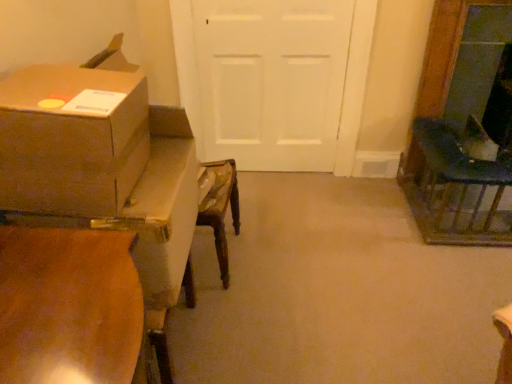
Question: Would you say wooden table at left is outside brown cardboard box at left?

Choices:
 (A) no
 (B) yes

Answer: (B)

Question: Can you confirm if wooden table at left is smaller than brown cardboard box at left?

Choices:
 (A) yes
 (B) no

Answer: (B)

Question: Is wooden table at left shorter than brown cardboard box at left?

Choices:
 (A) no
 (B) yes

Answer: (A)

Question: Considering the relative sizes of wooden table at left and brown cardboard box at left in the image provided, is wooden table at left thinner than brown cardboard box at left?

Choices:
 (A) yes
 (B) no

Answer: (B)

Question: Is brown cardboard box at left completely or partially inside wooden table at left?

Choices:
 (A) no
 (B) yes

Answer: (B)

Question: In terms of width, does brown cardboard box at left look wider or thinner when compared to wooden table at left?

Choices:
 (A) wide
 (B) thin

Answer: (B)

Question: From the image's perspective, relative to wooden table at left, is brown cardboard box at left above or below?

Choices:
 (A) below
 (B) above

Answer: (B)

Question: Is point (25, 162) positioned closer to the camera than point (47, 208)?

Choices:
 (A) farther
 (B) closer

Answer: (B)

Question: Visually, is brown cardboard box at left positioned to the left or to the right of wooden table at left?

Choices:
 (A) right
 (B) left

Answer: (B)

Question: Relative to dark green fabric chair at right, is white matte door at center in front or behind?

Choices:
 (A) behind
 (B) front

Answer: (A)

Question: Is white matte door at center to the left or to the right of dark green fabric chair at right in the image?

Choices:
 (A) left
 (B) right

Answer: (A)

Question: From the image's perspective, is white matte door at center above or below dark green fabric chair at right?

Choices:
 (A) above
 (B) below

Answer: (A)

Question: Considering the positions of white matte door at center and dark green fabric chair at right in the image, is white matte door at center wider or thinner than dark green fabric chair at right?

Choices:
 (A) thin
 (B) wide

Answer: (A)

Question: Is point (508, 165) positioned closer to the camera than point (178, 246)?

Choices:
 (A) farther
 (B) closer

Answer: (A)

Question: In terms of width, does dark green fabric chair at right look wider or thinner when compared to wooden table at left?

Choices:
 (A) thin
 (B) wide

Answer: (B)